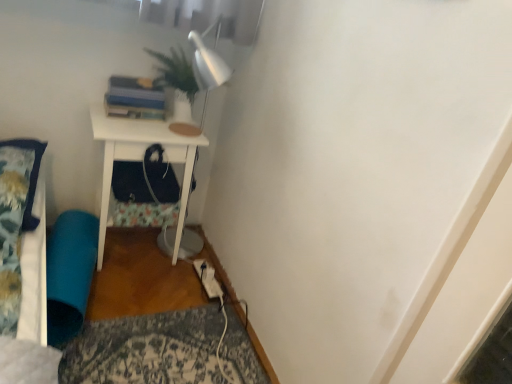
Find the location of a particular element. This screenshot has width=512, height=384. vacant space to the right of teal fabric bean bag at lower left is located at coordinates (139, 289).